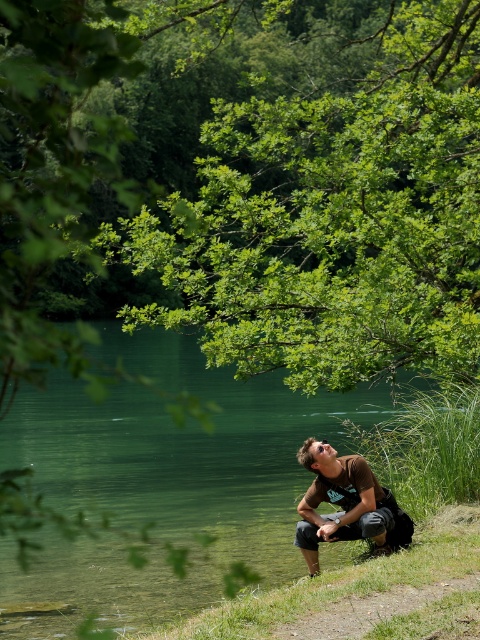
You are standing in the natural setting shown. You need to cross the water to reach the other side. The brown cotton shirt at center is an obstacle. Can you step over the green translucent water at lower left without getting your shoes wet?

The green translucent water at lower left has a greater height compared to the brown cotton shirt at center. Therefore, stepping over the green translucent water at lower left might get your shoes wet since it is deeper than the area around the brown cotton shirt at center.

You are an outdoor photographer planning to take a wide shot of the scene. You need to ensure that both the green translucent water at lower left and the brown cotton shirt at center are fully visible in the frame. Given their widths, which object requires more horizontal space in the composition?

The green translucent water at lower left requires more horizontal space because its width surpasses that of the brown cotton shirt at center.

You are a hiker who wants to cross the green translucent water at lower left to reach the brown cotton shirt at center. Is the water to the left or right of the shirt?

The green translucent water at lower left is to the left of the brown cotton shirt at center, so the water is on the left side of the shirt.